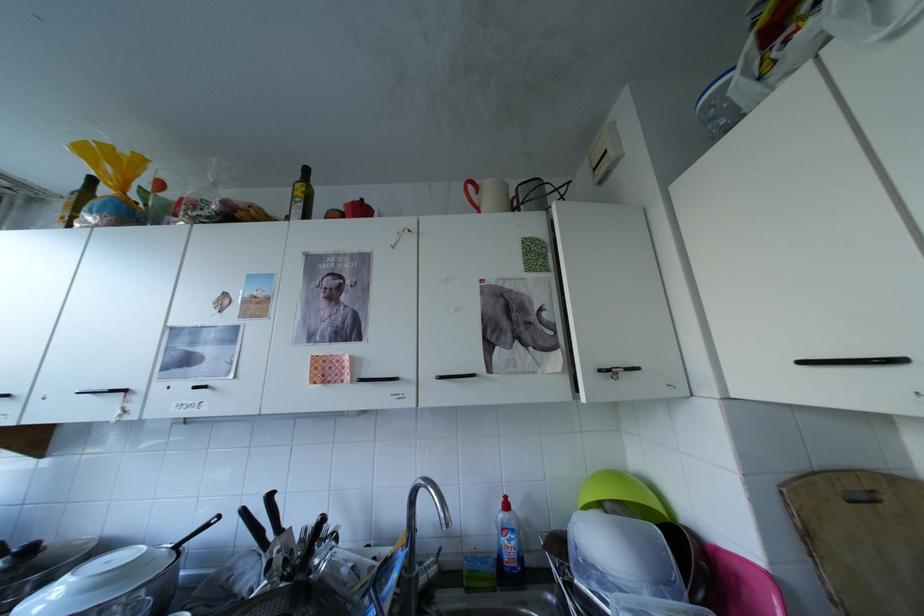
Image resolution: width=924 pixels, height=616 pixels. In order to click on red mug handle in this screenshot , I will do `click(471, 191)`.